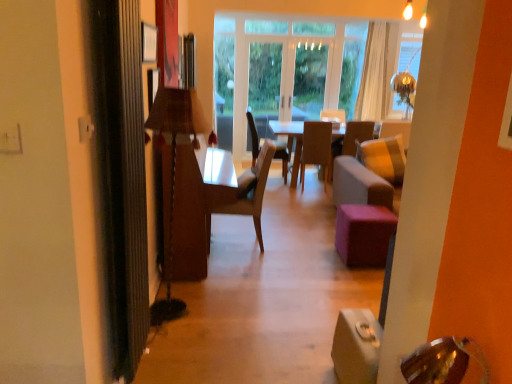
Question: From the image's perspective, is wooden lamp at left above light brown wood chair at center, the third chair viewed from the back?

Choices:
 (A) no
 (B) yes

Answer: (A)

Question: From the image's perspective, is wooden lamp at left below light brown wood chair at center, positioned as the first chair in left-to-right order?

Choices:
 (A) yes
 (B) no

Answer: (A)

Question: Can you confirm if wooden lamp at left is smaller than light brown wood chair at center, acting as the 1th chair starting from the front?

Choices:
 (A) yes
 (B) no

Answer: (A)

Question: Does wooden lamp at left come in front of light brown wood chair at center, the third chair viewed from the back?

Choices:
 (A) no
 (B) yes

Answer: (B)

Question: Is wooden lamp at left to the left of light brown wood chair at center, acting as the 1th chair starting from the front, from the viewer's perspective?

Choices:
 (A) yes
 (B) no

Answer: (A)

Question: Does point pyautogui.click(x=161, y=125) appear closer or farther from the camera than point pyautogui.click(x=233, y=210)?

Choices:
 (A) farther
 (B) closer

Answer: (B)

Question: Would you say wooden lamp at left is to the left or to the right of light brown wood chair at center, positioned as the first chair in left-to-right order, in the picture?

Choices:
 (A) right
 (B) left

Answer: (B)

Question: Is wooden lamp at left taller or shorter than light brown wood chair at center, placed as the third chair when sorted from right to left?

Choices:
 (A) tall
 (B) short

Answer: (A)

Question: Considering their positions, is wooden lamp at left located in front of or behind light brown wood chair at center, placed as the third chair when sorted from right to left?

Choices:
 (A) behind
 (B) front

Answer: (B)

Question: Which is correct: white sheer curtain at upper right is inside wooden lamp at left, or outside of it?

Choices:
 (A) outside
 (B) inside

Answer: (A)

Question: From a real-world perspective, is white sheer curtain at upper right physically located above or below wooden lamp at left?

Choices:
 (A) above
 (B) below

Answer: (A)

Question: Is white sheer curtain at upper right in front of or behind wooden lamp at left in the image?

Choices:
 (A) front
 (B) behind

Answer: (B)

Question: Is white sheer curtain at upper right taller or shorter than wooden lamp at left?

Choices:
 (A) tall
 (B) short

Answer: (A)

Question: From the image's perspective, is purple fabric stool at center located above or below wooden chair at center, arranged as the second chair when viewed from the right?

Choices:
 (A) below
 (B) above

Answer: (A)

Question: Looking at their shapes, would you say purple fabric stool at center is wider or thinner than wooden chair at center, positioned as the 2th chair in left-to-right order?

Choices:
 (A) thin
 (B) wide

Answer: (A)